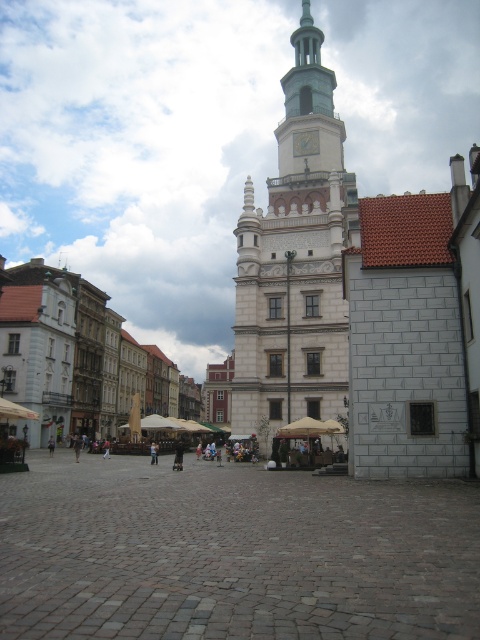
Does white stone building at left appear on the left side of light brown leather jacket at center?

Correct, you'll find white stone building at left to the left of light brown leather jacket at center.

Between white stone building at left and light brown leather jacket at center, which one appears on the left side from the viewer's perspective?

white stone building at left is more to the left.

Is point (175, 365) positioned after point (155, 444)?

Yes, point (175, 365) is behind point (155, 444).

Find the location of a particular element. The image size is (480, 640). white stone building at left is located at coordinates (81, 356).

Is point (280, 204) positioned behind point (34, 275)?

That is False.

The width and height of the screenshot is (480, 640). I want to click on white stone tower at center, so click(x=296, y=259).

Can you confirm if white stone tower at center is bigger than light brown leather jacket at center?

Correct, white stone tower at center is larger in size than light brown leather jacket at center.

Can you confirm if white stone tower at center is positioned above light brown leather jacket at center?

Yes.

Which is behind, point (321, 166) or point (156, 460)?

Positioned behind is point (321, 166).

You are a GUI agent. You are given a task and a screenshot of the screen. Output one action in this format:
    pyautogui.click(x=<x>, y=<y>)
    Task: Click on the white stone tower at center
    
    Given the screenshot: What is the action you would take?
    pyautogui.click(x=296, y=259)